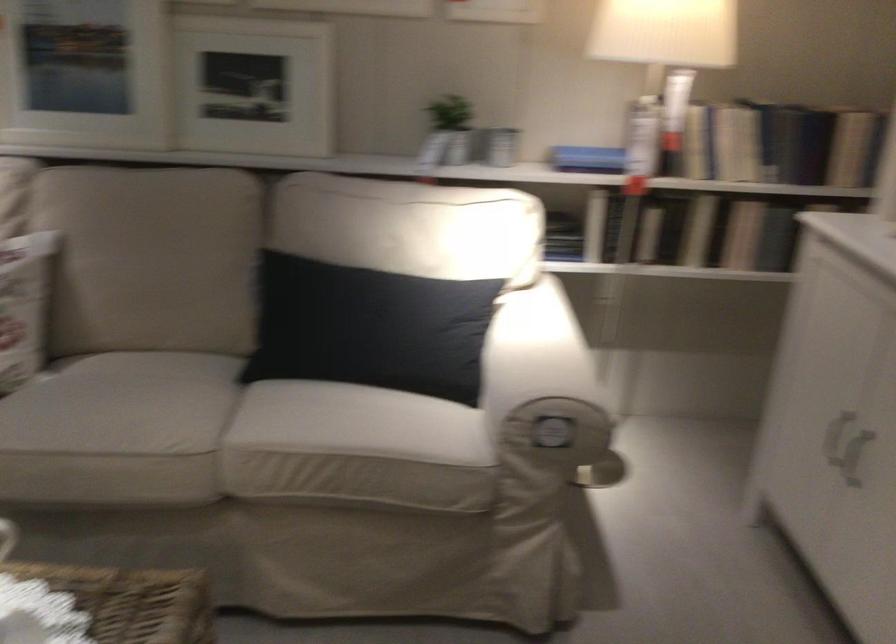
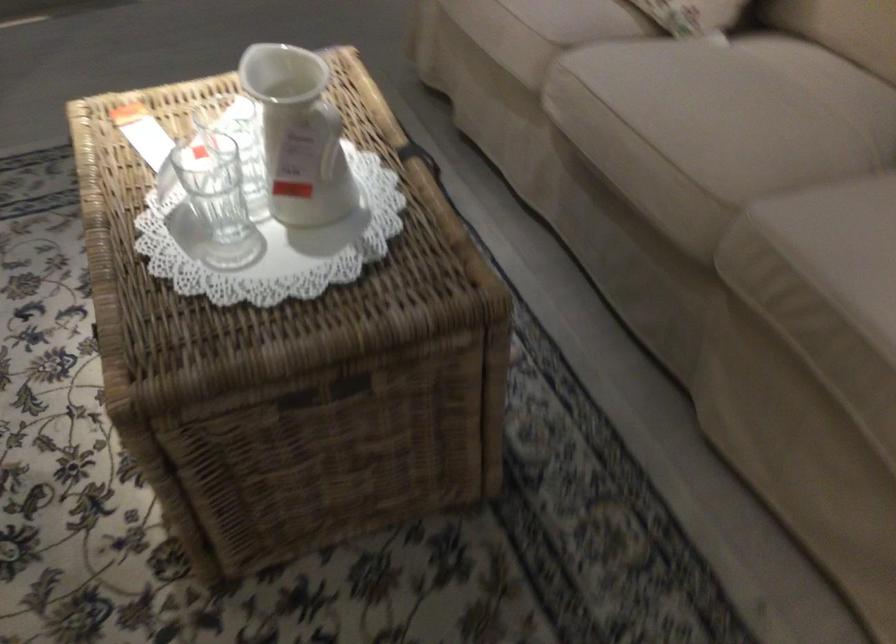
The images are taken continuously from a first-person perspective. In which direction is your viewpoint rotating?

The rotation direction of the camera is left-down.